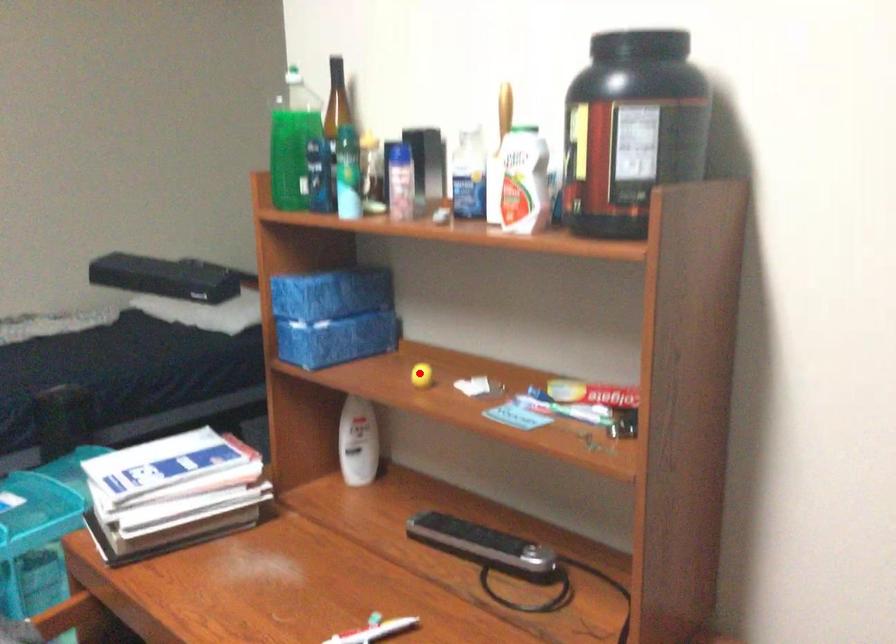
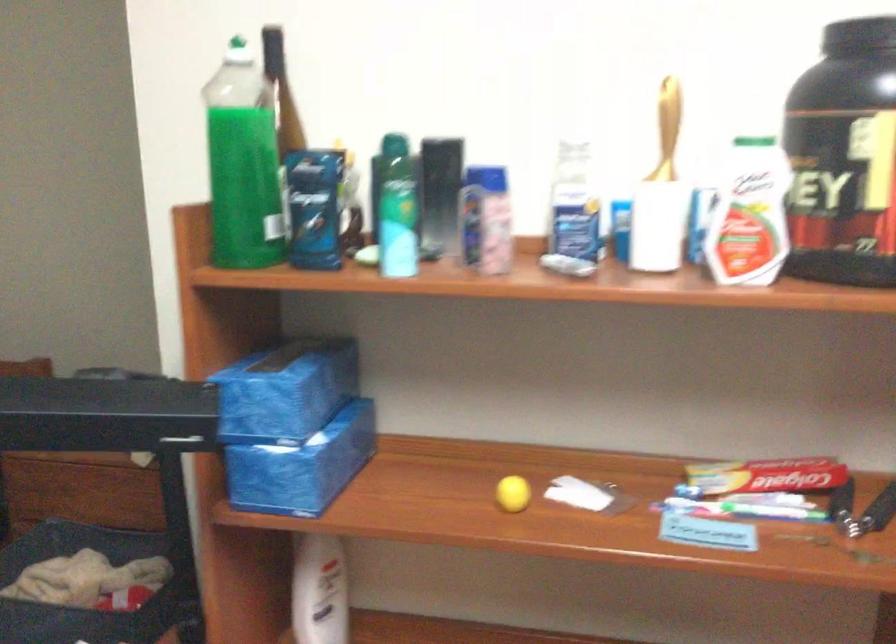
Where in the second image is the point corresponding to the highlighted location from the first image?

(513, 494)